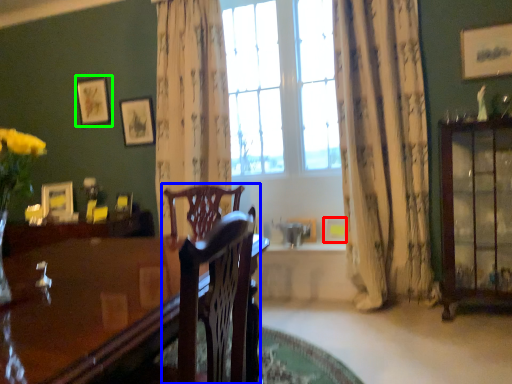
Question: Which object is the farthest from picture frame (highlighted by a red box)? Choose among these: chair (highlighted by a blue box) or picture frame (highlighted by a green box).

Choices:
 (A) chair
 (B) picture frame

Answer: (B)